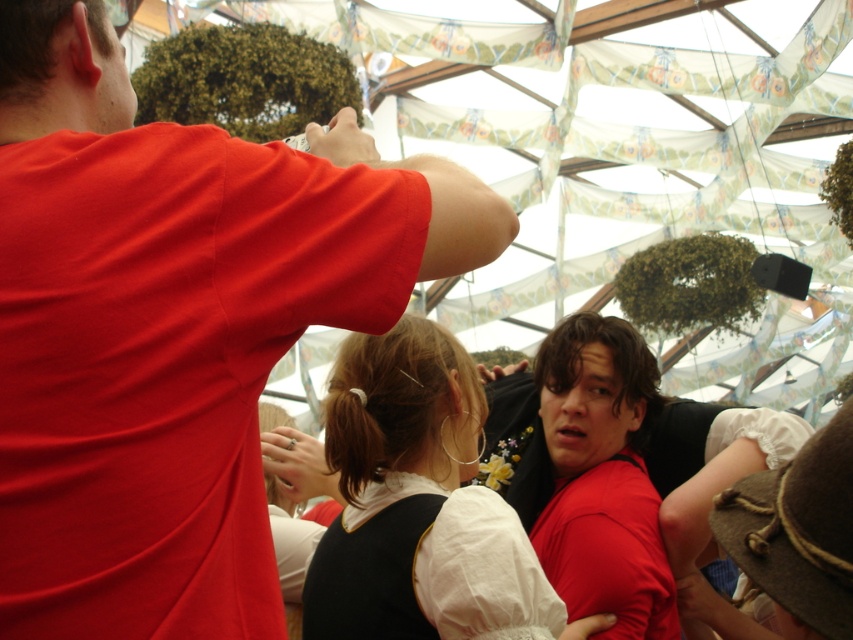
Question: Which point is closer to the camera taking this photo?

Choices:
 (A) (3, 545)
 (B) (428, 596)
 (C) (653, 372)
 (D) (720, 428)

Answer: (A)

Question: Can you confirm if matte black dress at center is thinner than matte white blouse at center?

Choices:
 (A) no
 (B) yes

Answer: (A)

Question: Which is farther from the matte red shirt at upper left?

Choices:
 (A) matte black dress at center
 (B) matte red shirt at center
 (C) matte white blouse at center

Answer: (C)

Question: Can you confirm if matte red shirt at upper left is thinner than matte black dress at center?

Choices:
 (A) yes
 (B) no

Answer: (B)

Question: Estimate the real-world distances between objects in this image. Which object is closer to the matte red shirt at center?

Choices:
 (A) matte red shirt at upper left
 (B) matte black dress at center

Answer: (B)

Question: Does matte red shirt at upper left have a smaller size compared to matte black dress at center?

Choices:
 (A) yes
 (B) no

Answer: (B)